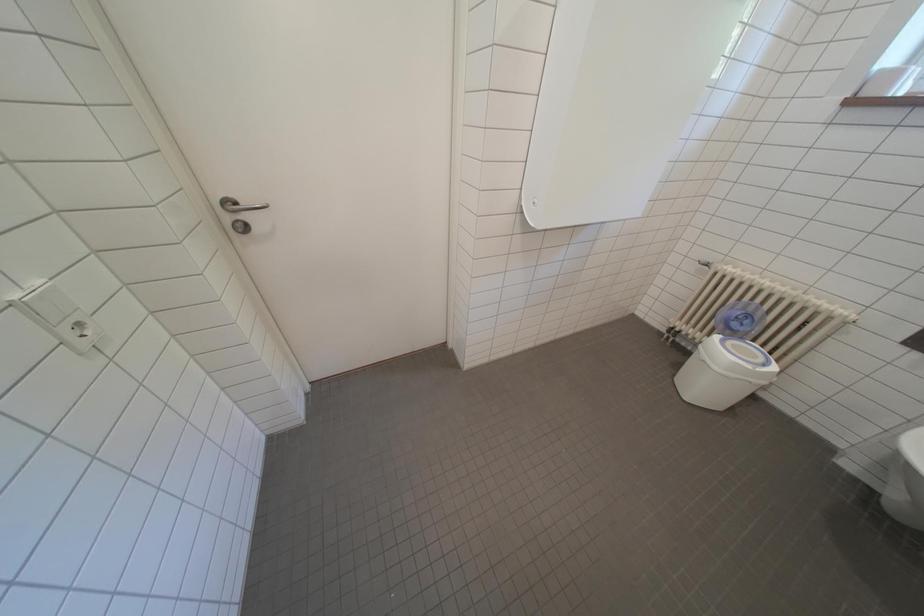
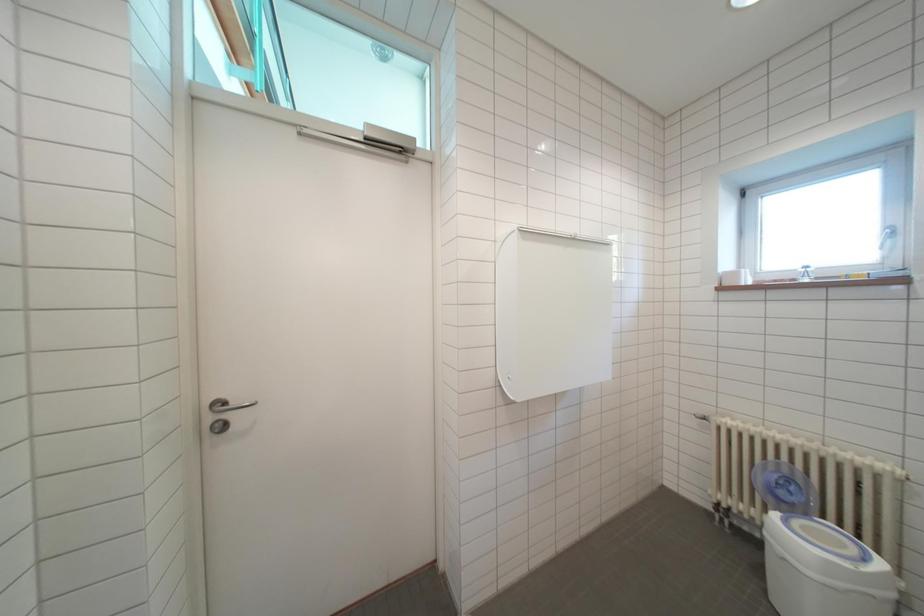
Question: How did the camera likely rotate?

Choices:
 (A) Left
 (B) Right
 (C) Up
 (D) Down

Answer: (C)